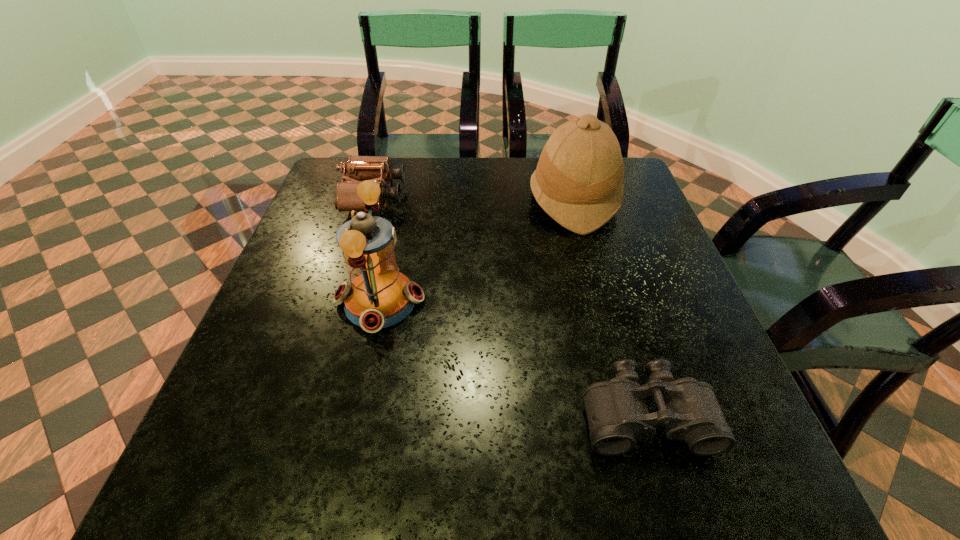
This screenshot has height=540, width=960. What are the coordinates of `free space between the third farthest object and the nearer binoculars` in the screenshot? It's located at (513, 359).

At what (x,y) coordinates should I click in order to perform the action: click on object that ranks as the third closest to the nearest object. Please return your answer as a coordinate pair (x, y). This screenshot has height=540, width=960. Looking at the image, I should click on (379, 169).

The height and width of the screenshot is (540, 960). I want to click on object that is the third closest to the farther binoculars, so click(x=617, y=414).